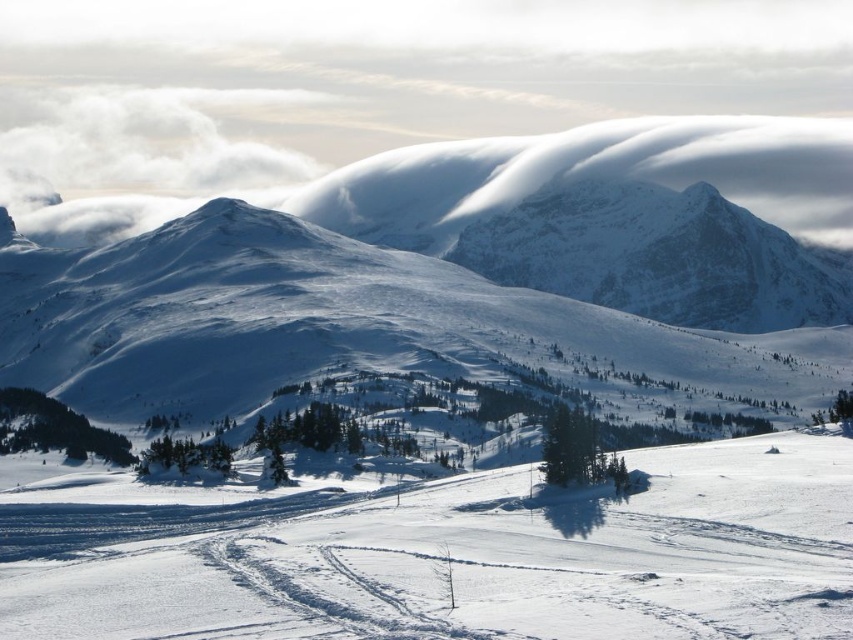
Question: In this image, where is white snow ski slope at center located relative to white snow-covered mountain at center?

Choices:
 (A) below
 (B) above

Answer: (A)

Question: Does white snow ski slope at center appear on the right side of white snow-covered mountain at center?

Choices:
 (A) yes
 (B) no

Answer: (A)

Question: Does white snow ski slope at center appear on the right side of white snow-covered mountain at center?

Choices:
 (A) yes
 (B) no

Answer: (A)